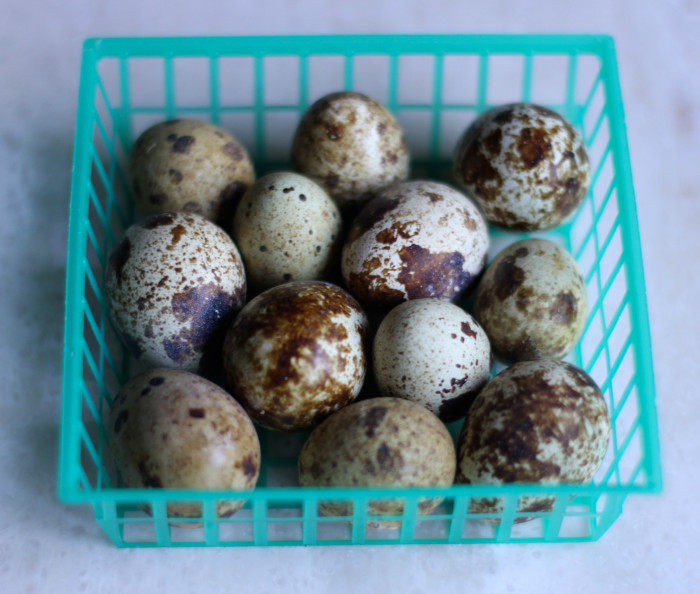
Where is `table`? The height and width of the screenshot is (594, 700). table is located at coordinates (14, 283).